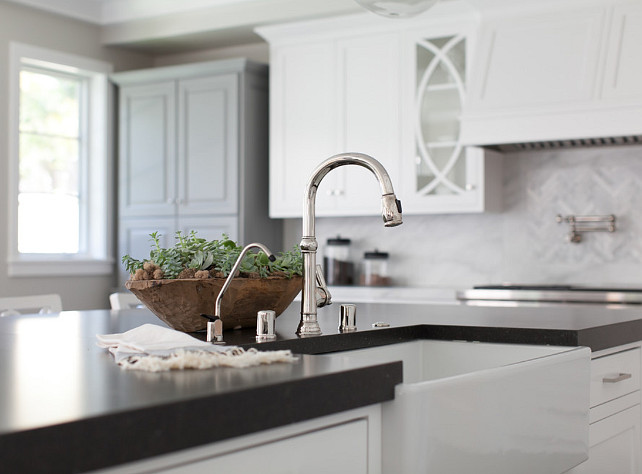
This screenshot has width=642, height=474. I want to click on counter, so click(27, 393), click(528, 330).